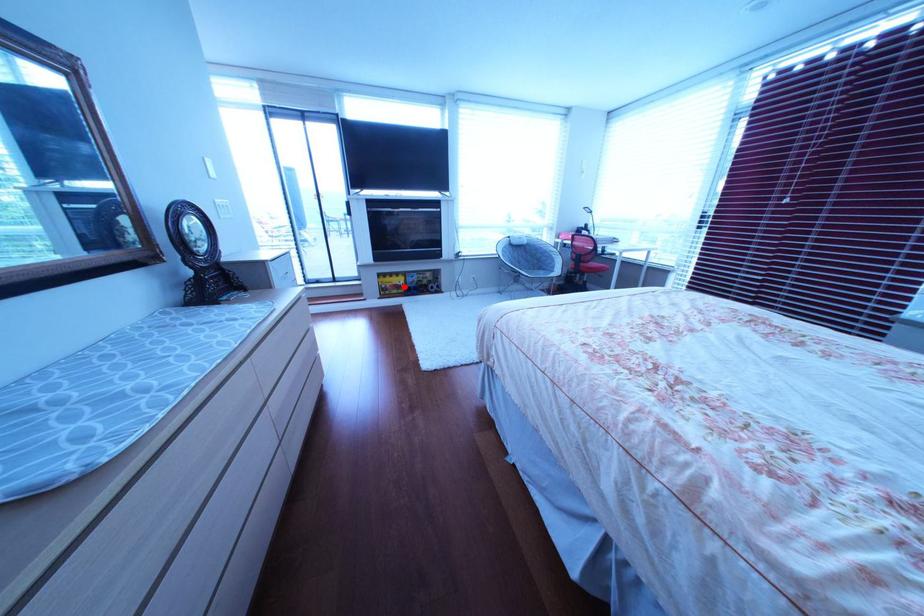
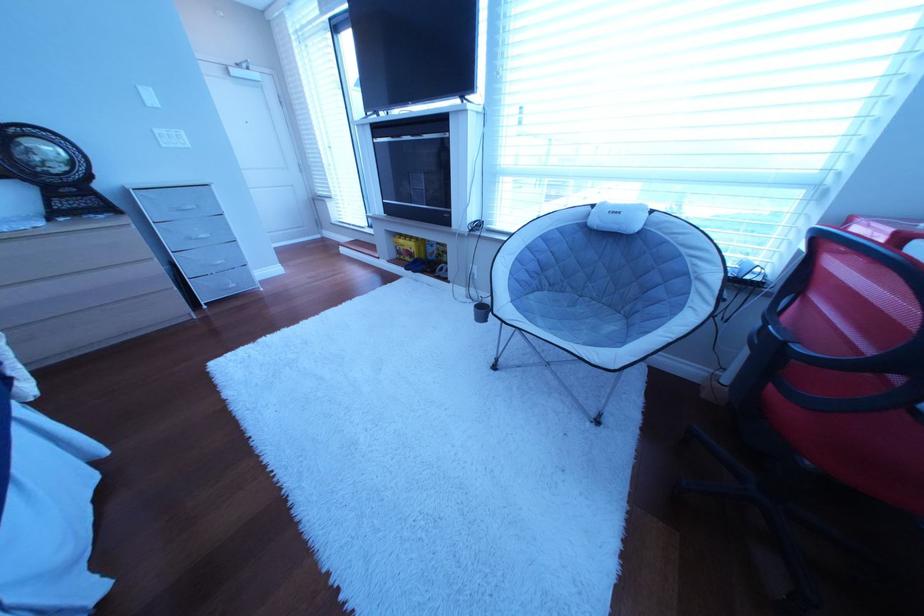
Question: I am providing you with two images of the same scene from different viewpoints. A red point is shown in image1. For the corresponding object point in image2, is it positioned nearer or farther from the camera?

Choices:
 (A) Nearer
 (B) Farther

Answer: (B)